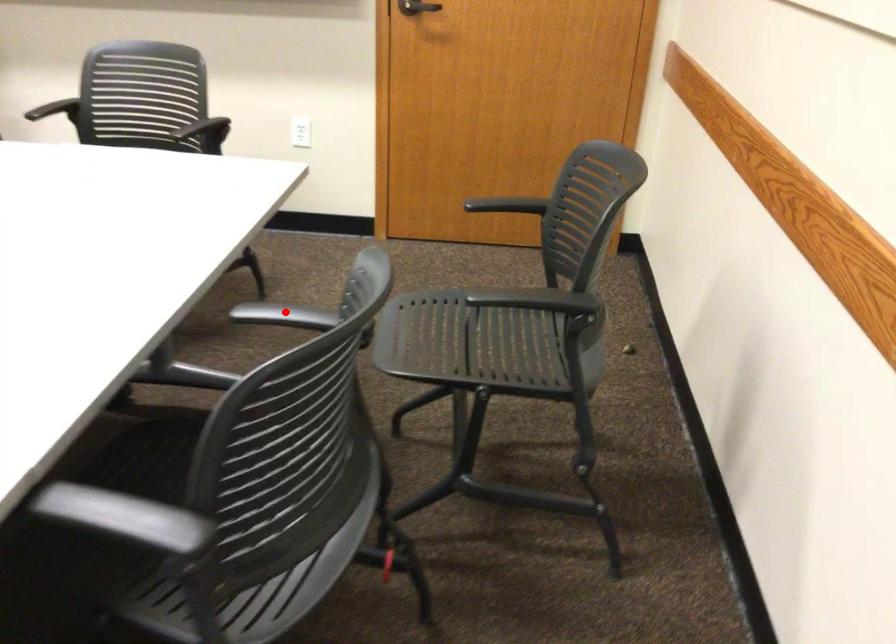
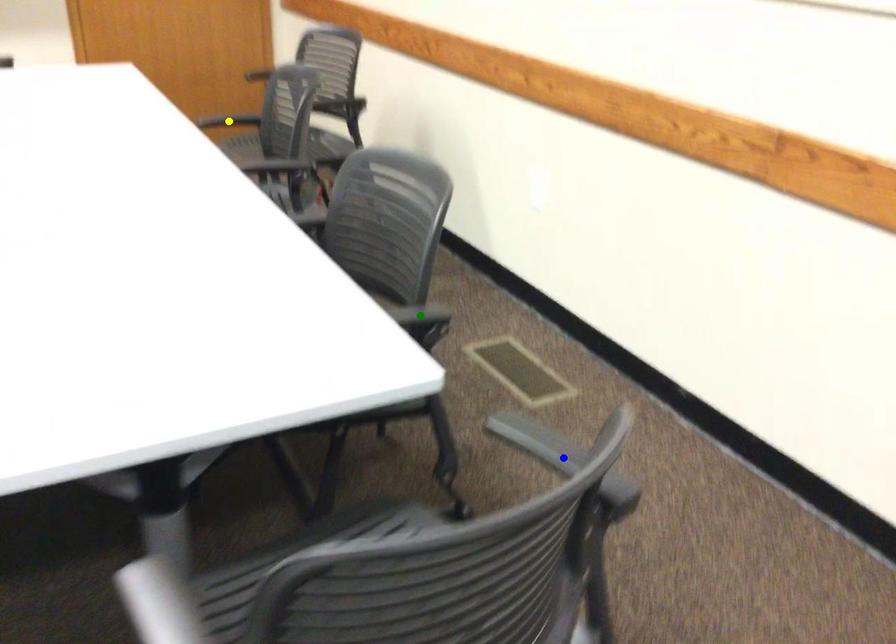
Question: I am providing you with two images of the same scene from different viewpoints. A red point is marked on the first image. You are given multiple points on the second image. In image 2, which mark is for the same physical point as the one in image 1?

Choices:
 (A) green point
 (B) blue point
 (C) yellow point

Answer: (C)